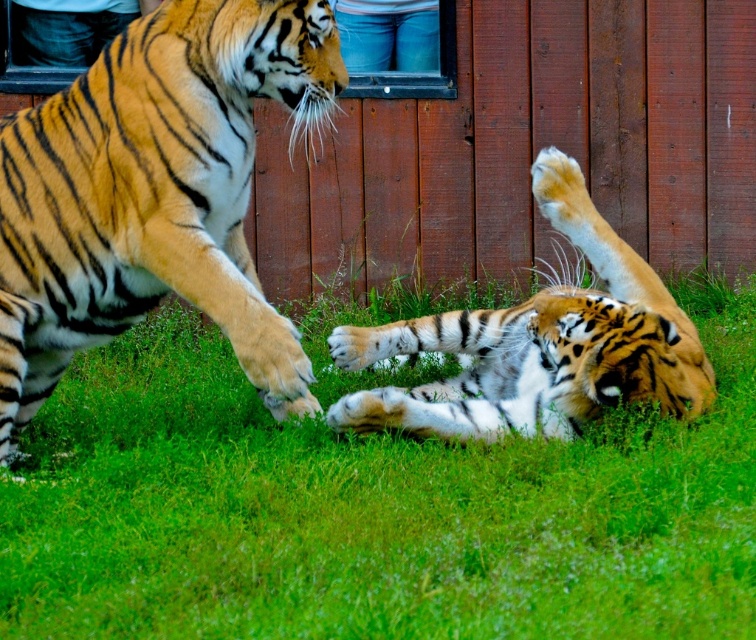
Question: Which object is the farthest from the orange fur tiger at left?

Choices:
 (A) orange and black striped tiger at lower right
 (B) green grass at center

Answer: (A)

Question: Among these objects, which one is farthest from the camera?

Choices:
 (A) orange fur tiger at left
 (B) orange and black striped tiger at lower right
 (C) green grass at center

Answer: (B)

Question: Is green grass at center below orange fur tiger at left?

Choices:
 (A) no
 (B) yes

Answer: (B)

Question: Which object appears farthest from the camera in this image?

Choices:
 (A) orange and black striped tiger at lower right
 (B) green grass at center
 (C) orange fur tiger at left

Answer: (A)

Question: Observing the image, what is the correct spatial positioning of green grass at center in reference to orange fur tiger at left?

Choices:
 (A) left
 (B) right

Answer: (B)

Question: Is green grass at center wider than orange and black striped tiger at lower right?

Choices:
 (A) yes
 (B) no

Answer: (A)